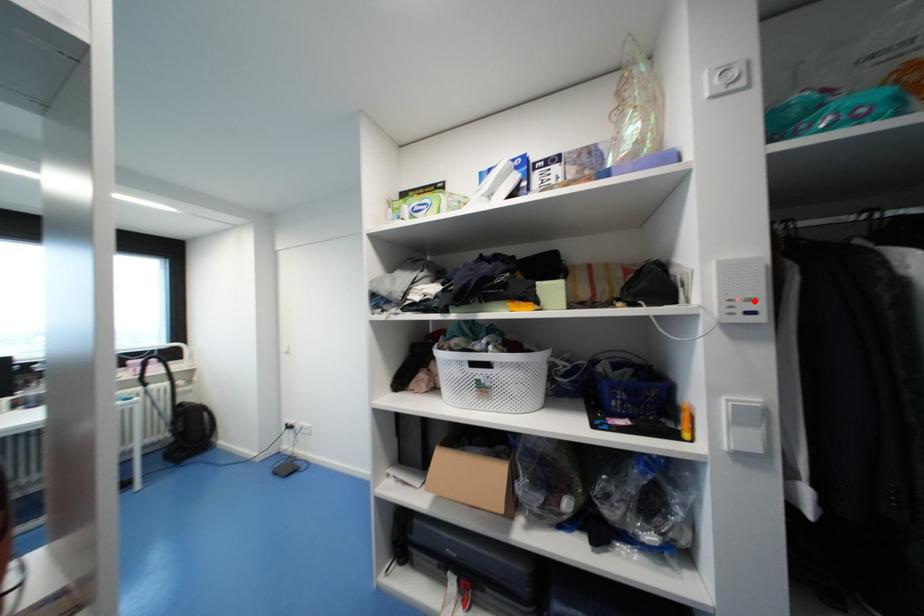
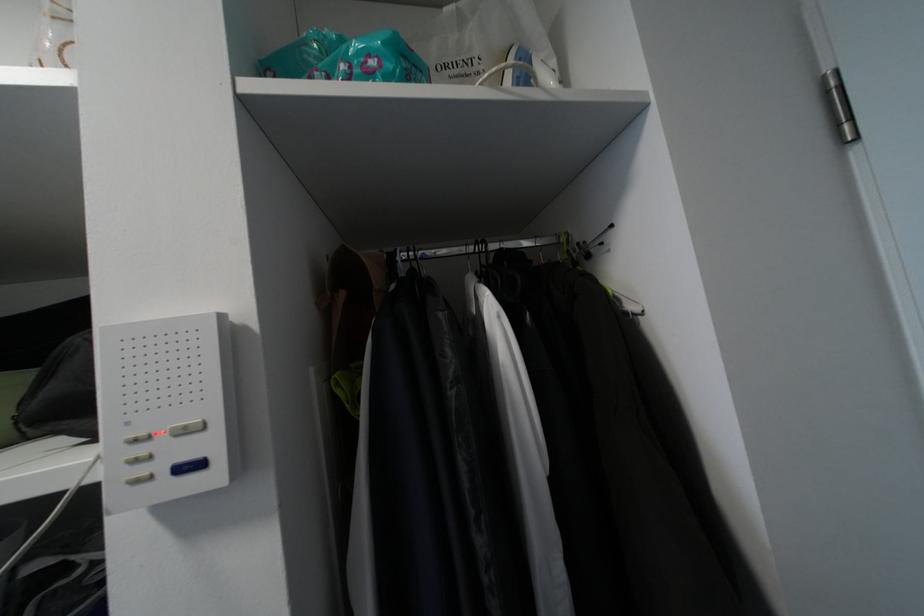
Find the pixel in the second image that matches the highlighted location in the first image.

(187, 432)